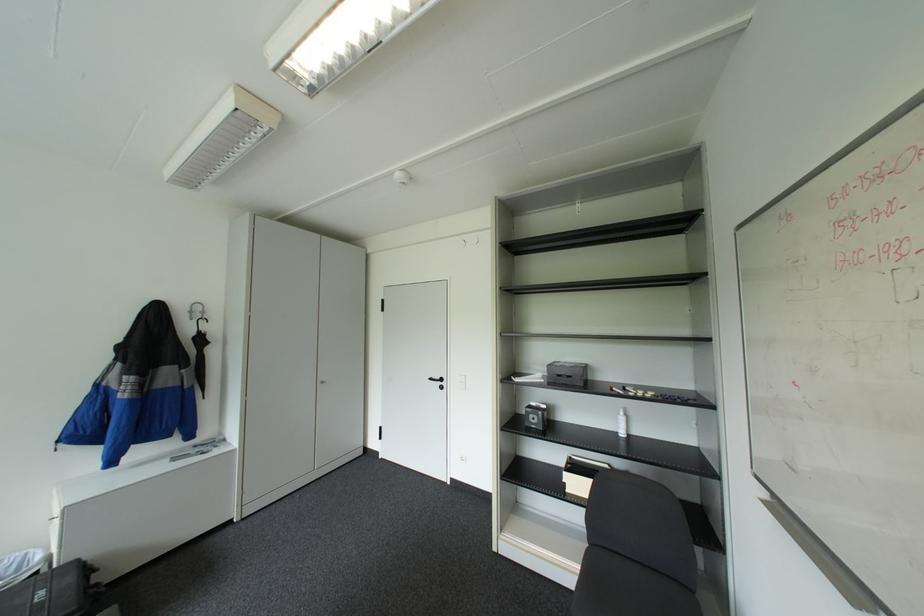
At what (x,y) coordinates should I click in order to perform the action: click on silver cabinet handle. Please return your answer as a coordinate pair (x, y). Looking at the image, I should click on (322, 379).